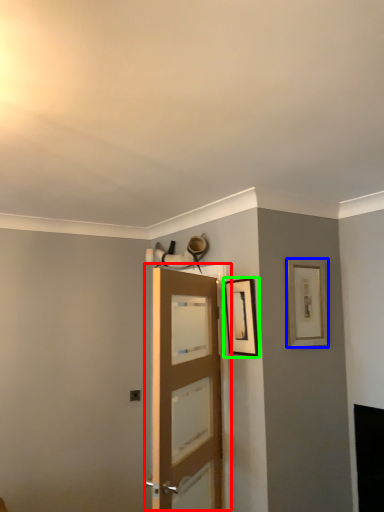
Question: Which object is positioned farthest from door (highlighted by a red box)? Select from picture frame (highlighted by a blue box) and picture frame (highlighted by a green box).

Choices:
 (A) picture frame
 (B) picture frame

Answer: (A)